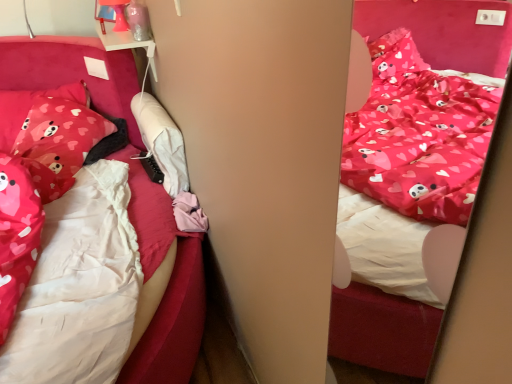
You are a GUI agent. You are given a task and a screenshot of the screen. Output one action in this format:
    pyautogui.click(x=<x>, y=<y>)
    Task: Click on the matte pink fabric bed at center
    The height and width of the screenshot is (384, 512).
    Given the screenshot: What is the action you would take?
    pyautogui.click(x=382, y=328)

In order to face matte pink pillow with heart patterns at left, the 2th pillow viewed from the right, should I rotate leftwards or rightwards?

To align with it, rotate left about 27.226°.

I want to click on matte pink fabric bed at center, so click(382, 328).

Would you say matte pink pillow with heart patterns at left, arranged as the first pillow when viewed from the right, contains matte pink pillow with heart patterns at left, the 1th pillow positioned from the left?

No, matte pink pillow with heart patterns at left, arranged as the first pillow when viewed from the right, does not contain matte pink pillow with heart patterns at left, the 1th pillow positioned from the left.

From the image's perspective, would you say matte pink pillow with heart patterns at left, which is the 2th pillow from left to right, is shown under matte pink pillow with heart patterns at left, the 2th pillow viewed from the right?

Yes, from the image's perspective, matte pink pillow with heart patterns at left, which is the 2th pillow from left to right, is below matte pink pillow with heart patterns at left, the 2th pillow viewed from the right.

Considering the sizes of matte pink pillow with heart patterns at left, arranged as the first pillow when viewed from the right, and matte pink pillow with heart patterns at left, the 2th pillow viewed from the right, in the image, is matte pink pillow with heart patterns at left, arranged as the first pillow when viewed from the right, wider or thinner than matte pink pillow with heart patterns at left, the 2th pillow viewed from the right,?

In the image, matte pink pillow with heart patterns at left, arranged as the first pillow when viewed from the right, appears to be more narrow than matte pink pillow with heart patterns at left, the 2th pillow viewed from the right.

From a real-world perspective, which is physically below, matte pink pillow with heart patterns at left, which is the 2th pillow from left to right, or matte pink fabric bed at center?

matte pink pillow with heart patterns at left, which is the 2th pillow from left to right, from a real-world perspective.

Is matte pink pillow with heart patterns at left, arranged as the first pillow when viewed from the right, far from matte pink fabric bed at center?

Yes, matte pink pillow with heart patterns at left, arranged as the first pillow when viewed from the right, and matte pink fabric bed at center are quite far apart.

At what (x,y) coordinates should I click in order to perform the action: click on bed below the matte pink pillow with heart patterns at left, which is the 2th pillow from left to right (from the image's perspective). Please return your answer as a coordinate pair (x, y). This screenshot has height=384, width=512. Looking at the image, I should click on point(382,328).

Consider the image. What's the angular difference between matte pink pillow with heart patterns at left, which is the 2th pillow from left to right, and matte pink fabric bed at center's facing directions?

42.3 degrees.

From a real-world perspective, does matte pink fabric bed at center sit lower than matte pink pillow with heart patterns at left, arranged as the first pillow when viewed from the right?

No, from a real-world perspective, matte pink fabric bed at center is not under matte pink pillow with heart patterns at left, arranged as the first pillow when viewed from the right.

Looking at this image, how different are the orientations of matte pink fabric bed at center and matte pink pillow with heart patterns at left, arranged as the first pillow when viewed from the right, in degrees?

42.3 degrees.

Considering the sizes of matte pink fabric bed at center and matte pink pillow with heart patterns at left, arranged as the first pillow when viewed from the right, in the image, is matte pink fabric bed at center wider or thinner than matte pink pillow with heart patterns at left, arranged as the first pillow when viewed from the right,?

Considering their sizes, matte pink fabric bed at center looks slimmer than matte pink pillow with heart patterns at left, arranged as the first pillow when viewed from the right.

Considering the sizes of objects matte pink fabric bed at center and matte pink pillow with heart patterns at left, which is the 2th pillow from left to right, in the image provided, who is taller, matte pink fabric bed at center or matte pink pillow with heart patterns at left, which is the 2th pillow from left to right,?

matte pink fabric bed at center.

Find the location of a particular element. bed positioned vertically above the matte pink pillow with heart patterns at left, the 2th pillow viewed from the right (from a real-world perspective) is located at coordinates (382, 328).

Is matte pink pillow with heart patterns at left, the 1th pillow positioned from the left, next to matte pink fabric bed at center?

No, matte pink pillow with heart patterns at left, the 1th pillow positioned from the left, is not next to matte pink fabric bed at center.

Between matte pink pillow with heart patterns at left, the 2th pillow viewed from the right, and matte pink fabric bed at center, which one appears on the right side from the viewer's perspective?

From the viewer's perspective, matte pink fabric bed at center appears more on the right side.

Considering the relative sizes of matte pink pillow with heart patterns at left, the 2th pillow viewed from the right, and matte pink fabric bed at center in the image provided, is matte pink pillow with heart patterns at left, the 2th pillow viewed from the right, smaller than matte pink fabric bed at center?

No, matte pink pillow with heart patterns at left, the 2th pillow viewed from the right, is not smaller than matte pink fabric bed at center.

Between matte pink pillow with heart patterns at left, the 2th pillow viewed from the right, and matte pink pillow with heart patterns at left, arranged as the first pillow when viewed from the right, which one appears on the right side from the viewer's perspective?

matte pink pillow with heart patterns at left, arranged as the first pillow when viewed from the right, is more to the right.

Which is closer, (5,133) or (23,158)?

Point (23,158)

From a real-world perspective, relative to matte pink pillow with heart patterns at left, arranged as the first pillow when viewed from the right, is matte pink pillow with heart patterns at left, the 2th pillow viewed from the right, vertically above or below?

matte pink pillow with heart patterns at left, the 2th pillow viewed from the right, is above matte pink pillow with heart patterns at left, arranged as the first pillow when viewed from the right.

Looking at this image, considering the relative sizes of matte pink pillow with heart patterns at left, the 2th pillow viewed from the right, and matte pink pillow with heart patterns at left, arranged as the first pillow when viewed from the right, in the image provided, is matte pink pillow with heart patterns at left, the 2th pillow viewed from the right, wider than matte pink pillow with heart patterns at left, arranged as the first pillow when viewed from the right,?

Yes.

Which object is positioned more to the left, matte pink fabric bed at center or matte pink pillow with heart patterns at left, the 1th pillow positioned from the left?

Positioned to the left is matte pink pillow with heart patterns at left, the 1th pillow positioned from the left.

In the image, is matte pink fabric bed at center positioned in front of or behind matte pink pillow with heart patterns at left, the 2th pillow viewed from the right?

matte pink fabric bed at center is in front of matte pink pillow with heart patterns at left, the 2th pillow viewed from the right.

Is point (479, 48) farther from camera compared to point (84, 101)?

Yes, point (479, 48) is farther from viewer.

From a real-world perspective, is matte pink fabric bed at center under matte pink pillow with heart patterns at left, the 2th pillow viewed from the right?

No.

Where is `pillow behind the matte pink pillow with heart patterns at left, which is the 2th pillow from left to right`? The width and height of the screenshot is (512, 384). pillow behind the matte pink pillow with heart patterns at left, which is the 2th pillow from left to right is located at coordinates (30, 108).

Find the location of a particular element. bed positioned vertically above the matte pink pillow with heart patterns at left, which is the 2th pillow from left to right (from a real-world perspective) is located at coordinates (382, 328).

Looking at the image, which one is located closer to matte pink fabric bed at center, matte pink pillow with heart patterns at left, arranged as the first pillow when viewed from the right, or matte pink pillow with heart patterns at left, the 1th pillow positioned from the left?

Among the two, matte pink pillow with heart patterns at left, arranged as the first pillow when viewed from the right, is located nearer to matte pink fabric bed at center.

From the image, which object appears to be farther from matte pink pillow with heart patterns at left, the 1th pillow positioned from the left, matte pink fabric bed at center or matte pink pillow with heart patterns at left, which is the 2th pillow from left to right?

matte pink fabric bed at center is positioned further to the anchor matte pink pillow with heart patterns at left, the 1th pillow positioned from the left.

When comparing their distances from matte pink pillow with heart patterns at left, which is the 2th pillow from left to right, does matte pink fabric bed at center or matte pink pillow with heart patterns at left, the 1th pillow positioned from the left, seem further?

Based on the image, matte pink fabric bed at center appears to be further to matte pink pillow with heart patterns at left, which is the 2th pillow from left to right.

When comparing their distances from matte pink pillow with heart patterns at left, the 1th pillow positioned from the left, does matte pink pillow with heart patterns at left, which is the 2th pillow from left to right, or matte pink fabric bed at center seem closer?

matte pink pillow with heart patterns at left, which is the 2th pillow from left to right, is closer to matte pink pillow with heart patterns at left, the 1th pillow positioned from the left.

Which object lies further to the anchor point matte pink fabric bed at center, matte pink pillow with heart patterns at left, the 1th pillow positioned from the left, or matte pink pillow with heart patterns at left, which is the 2th pillow from left to right?

Based on the image, matte pink pillow with heart patterns at left, the 1th pillow positioned from the left, appears to be further to matte pink fabric bed at center.

From the image, which object appears to be nearer to matte pink pillow with heart patterns at left, which is the 2th pillow from left to right, matte pink pillow with heart patterns at left, the 1th pillow positioned from the left, or matte pink fabric bed at center?

The object closer to matte pink pillow with heart patterns at left, which is the 2th pillow from left to right, is matte pink pillow with heart patterns at left, the 1th pillow positioned from the left.

This screenshot has height=384, width=512. What are the coordinates of `pillow between matte pink fabric bed at center and matte pink pillow with heart patterns at left, the 2th pillow viewed from the right, from front to back` in the screenshot? It's located at (58, 142).